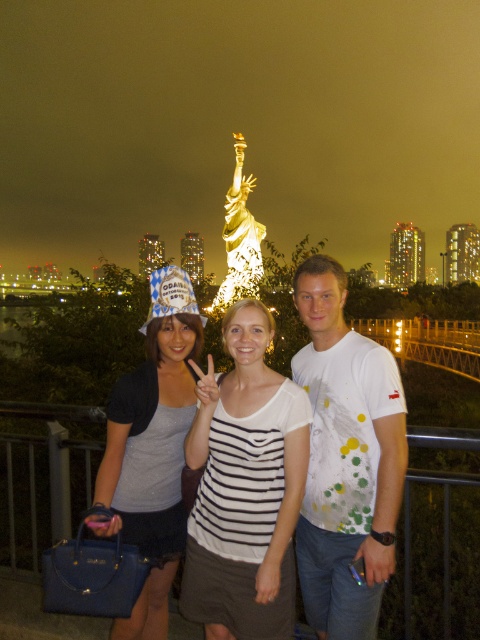
Identify the location of white painted t-shirt at center. This screenshot has width=480, height=640. (346, 458).

Looking at this image, which of these two, white painted t-shirt at center or white striped shirt at center, stands shorter?

With less height is white striped shirt at center.

This screenshot has height=640, width=480. Identify the location of white painted t-shirt at center. (346, 458).

Locate an element on the screen. The width and height of the screenshot is (480, 640). white striped shirt at center is located at coordinates (245, 486).

Does white striped shirt at center appear on the right side of matte gray tank top at center?

Yes, white striped shirt at center is to the right of matte gray tank top at center.

Measure the distance between white striped shirt at center and camera.

They are 478.93 feet apart.

Where is `white striped shirt at center`? white striped shirt at center is located at coordinates (245, 486).

Consider the image. Is white painted t-shirt at center above matte gray tank top at center?

Yes.

Between point (338, 307) and point (156, 308), which one is positioned behind?

The point (338, 307) is more distant.

This screenshot has width=480, height=640. I want to click on white painted t-shirt at center, so click(346, 458).

Locate an element on the screen. This screenshot has height=640, width=480. white painted t-shirt at center is located at coordinates (346, 458).